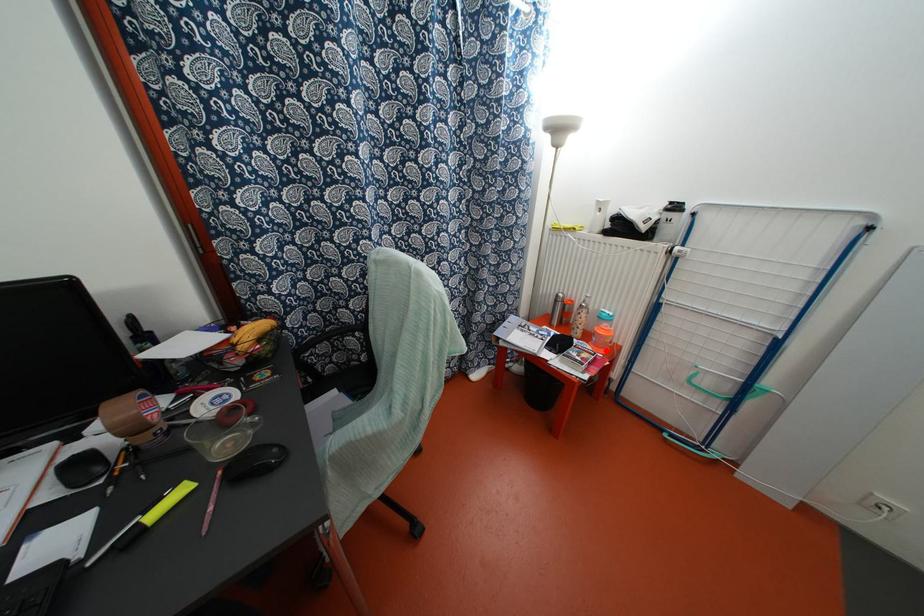
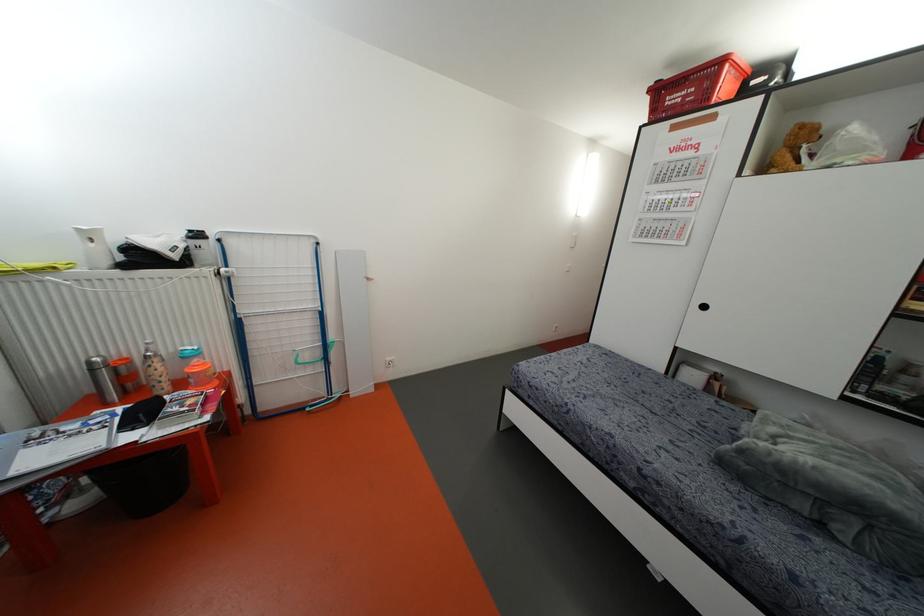
Find the pixel in the second image that matches the highlighted location in the first image.

(215, 383)